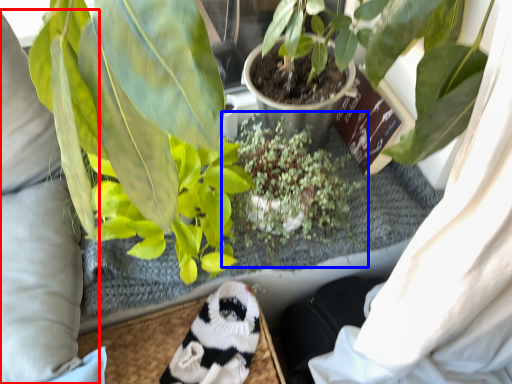
Question: Which point is further to the camera, clothing (highlighted by a red box) or houseplant (highlighted by a blue box)?

Choices:
 (A) clothing
 (B) houseplant

Answer: (B)